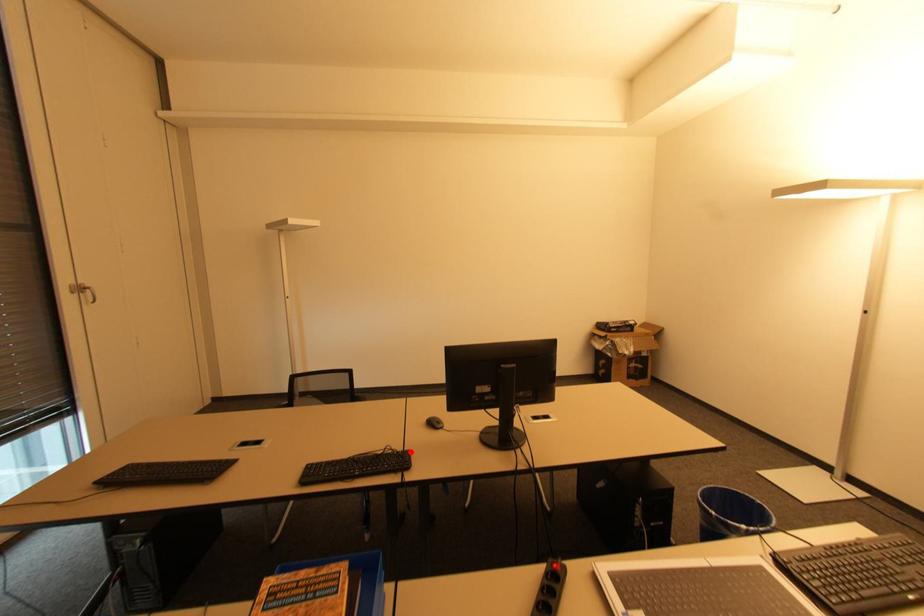
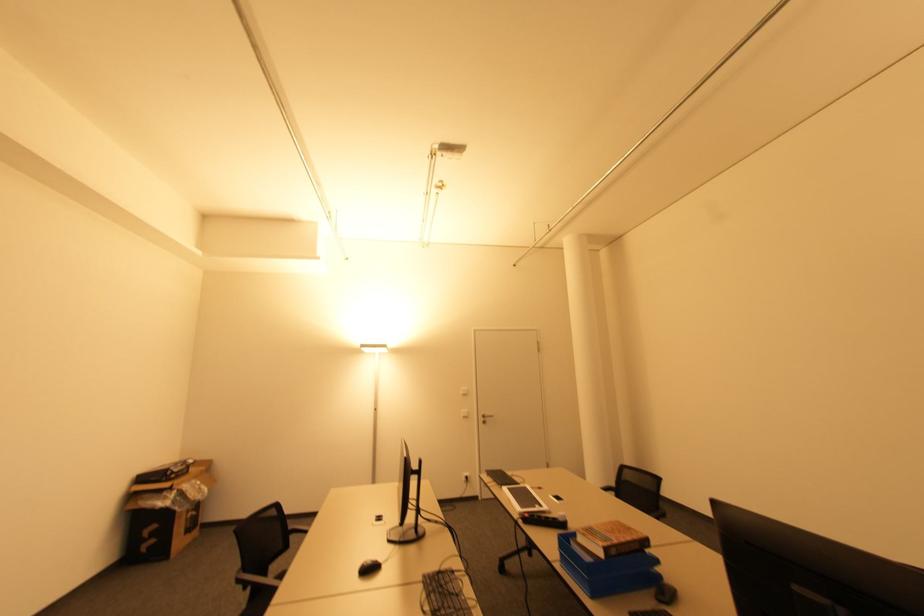
Find the pixel in the second image that matches the highlighted location in the first image.

(427, 576)